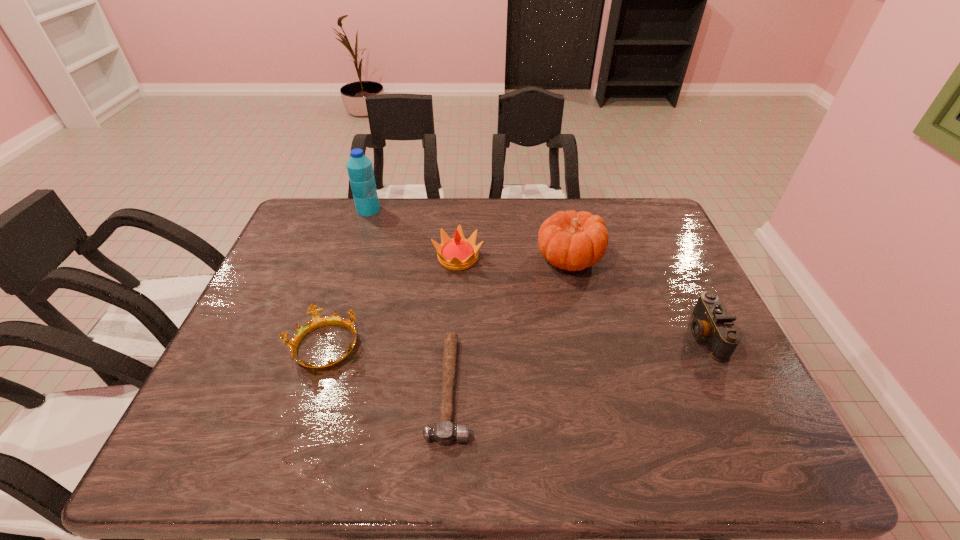
Where is `water bottle`? water bottle is located at coordinates (360, 170).

Where is `the farthest object`? This screenshot has height=540, width=960. the farthest object is located at coordinates (360, 170).

You are a GUI agent. You are given a task and a screenshot of the screen. Output one action in this format:
    pyautogui.click(x=<x>, y=<y>)
    Task: Click on the second object from right to left
    
    Given the screenshot: What is the action you would take?
    pyautogui.click(x=573, y=241)

This screenshot has height=540, width=960. I want to click on pumpkin, so tap(573, 241).

Locate an element on the screen. This screenshot has width=960, height=540. the taller crown is located at coordinates (459, 253).

Find the location of `the third tallest object`. the third tallest object is located at coordinates (459, 253).

Identify the location of the fourth tallest object. The image size is (960, 540). (711, 321).

You are a GUI agent. You are given a task and a screenshot of the screen. Output one action in this format:
    pyautogui.click(x=<x>, y=<y>)
    Task: Click on the rightmost object
    The height and width of the screenshot is (540, 960).
    Given the screenshot: What is the action you would take?
    (711, 321)

At what (x,y) coordinates should I click in order to perform the action: click on the nearer crown. Please return your answer as a coordinate pair (x, y). This screenshot has height=540, width=960. Looking at the image, I should click on (317, 321).

Find the location of a particular element. The image size is (960, 540). the fifth tallest object is located at coordinates (317, 321).